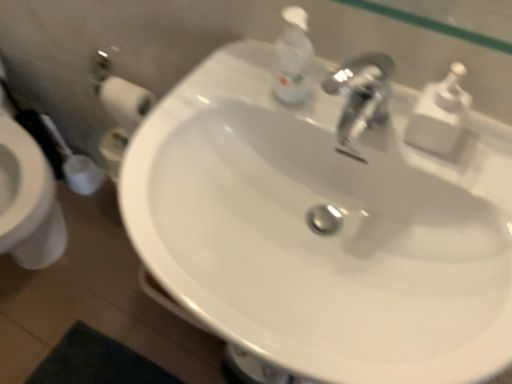
Where is `vacant area situated to the left side of white plastic soap dispenser at upper center, the first soap dispenser from the left`? Image resolution: width=512 pixels, height=384 pixels. vacant area situated to the left side of white plastic soap dispenser at upper center, the first soap dispenser from the left is located at coordinates (213, 94).